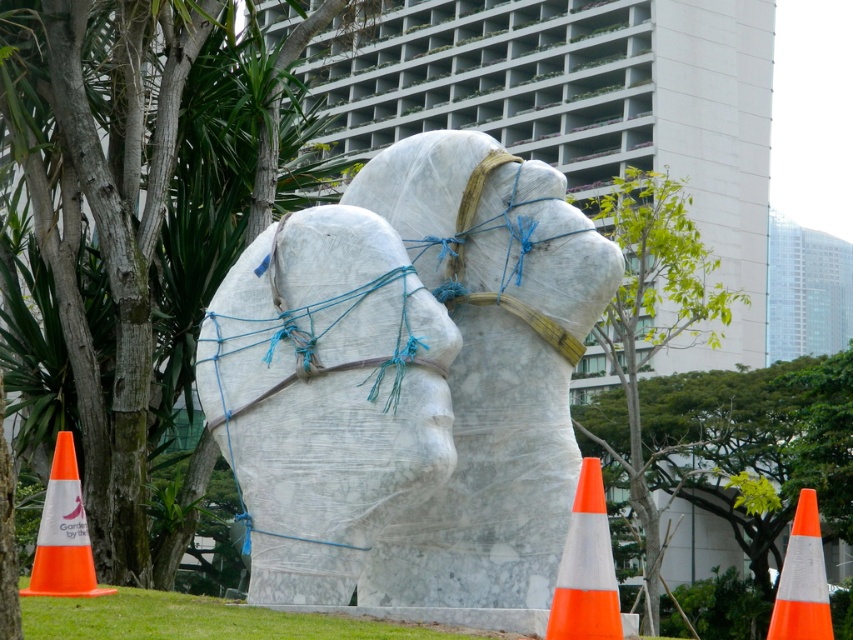
You are a delivery person needing to place a package between the orange plastic traffic cone at lower left and the orange reflective cone at lower right. The package requires a space of 15 meters. Can you place it there?

The distance between the orange plastic traffic cone at lower left and orange reflective cone at lower right is 17.55 meters, so yes, the package requiring 15 meters of space can be placed there as there is sufficient room.